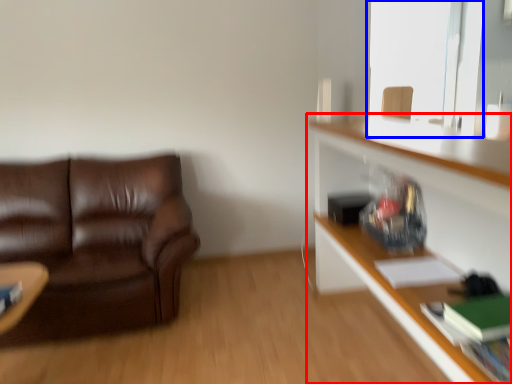
Question: Which object appears closest to the camera in this image, shelf (highlighted by a red box) or window screen (highlighted by a blue box)?

Choices:
 (A) shelf
 (B) window screen

Answer: (A)